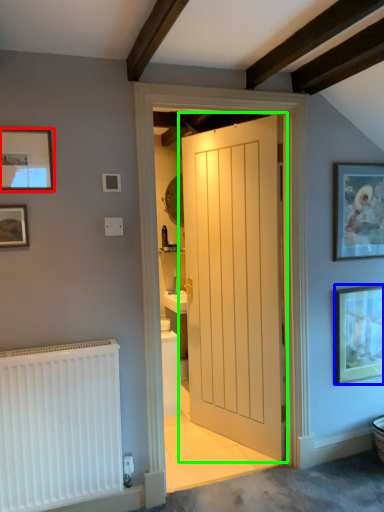
Question: Which object is positioned farthest from picture frame (highlighted by a red box)? Select from picture frame (highlighted by a blue box) and door (highlighted by a green box).

Choices:
 (A) picture frame
 (B) door

Answer: (A)